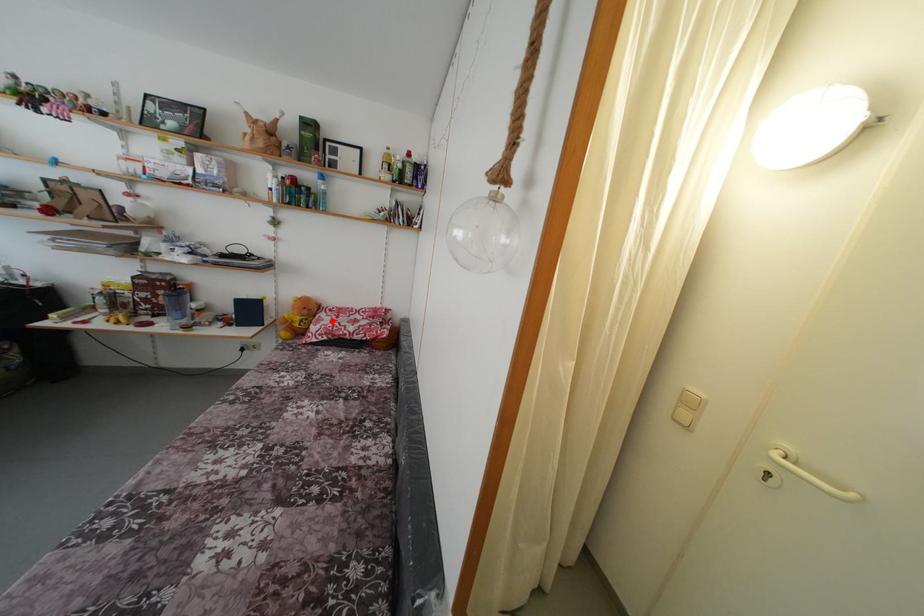
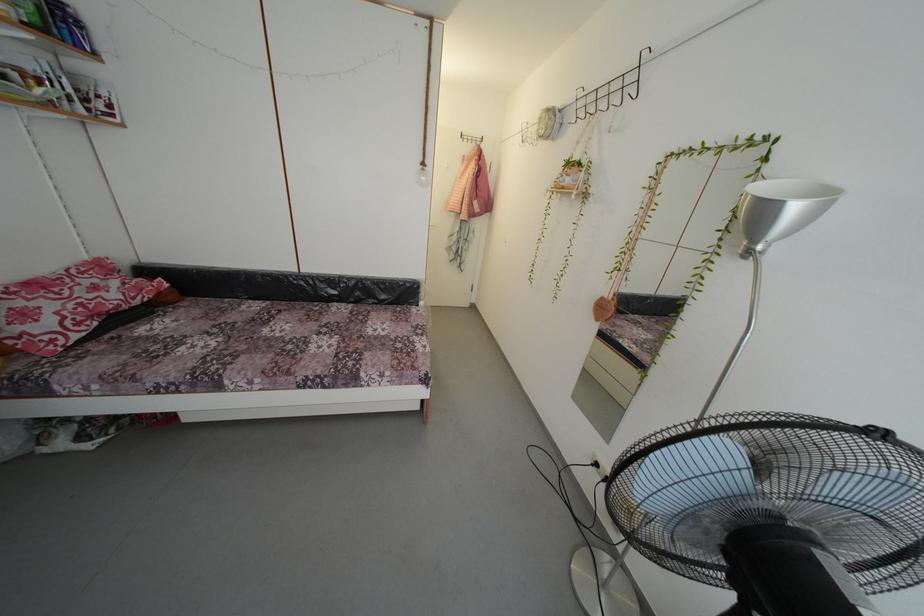
Question: I am providing you with two images of the same scene from different viewpoints. In image1, a red point is highlighted. Considering the same 3D point in image2, which of the following is correct?

Choices:
 (A) It is closer
 (B) It is farther

Answer: (B)